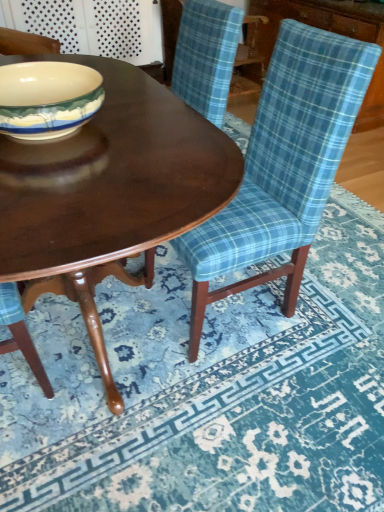
Find the location of `blank space above shiny dark wood coffee table at center (from a real-world perspective)`. blank space above shiny dark wood coffee table at center (from a real-world perspective) is located at coordinates pos(111,140).